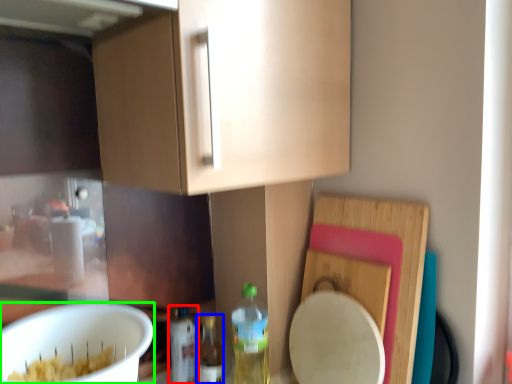
Question: Which object is positioned closest to bottle (highlighted by a red box)? Select from bottle (highlighted by a blue box) and mixing bowl (highlighted by a green box).

Choices:
 (A) bottle
 (B) mixing bowl

Answer: (A)